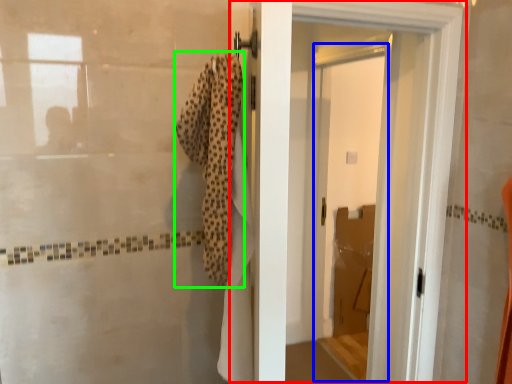
Question: Estimate the real-world distances between objects in this image. Which object is closer to door (highlighted by a red box), screen door (highlighted by a blue box) or bath towel (highlighted by a green box)?

Choices:
 (A) screen door
 (B) bath towel

Answer: (B)